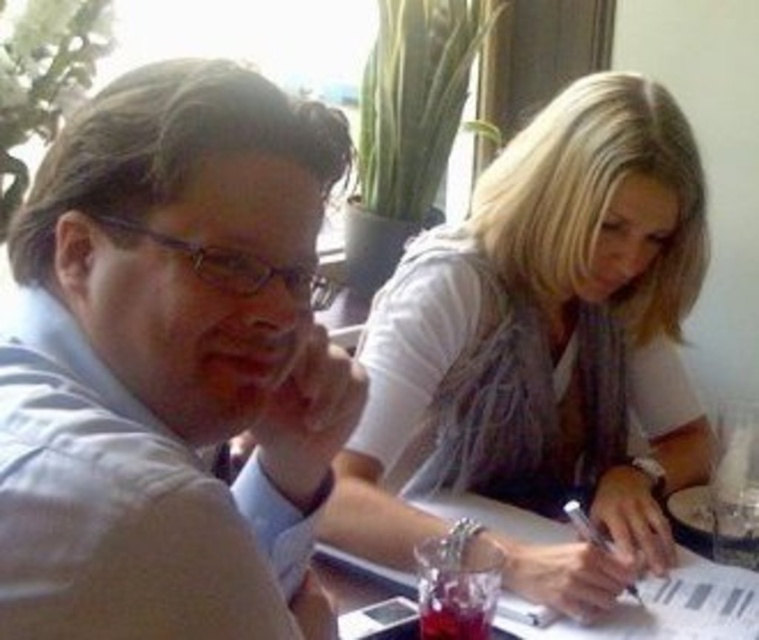
Question: Does white fabric shirt at upper right have a larger size compared to clear plastic table at center?

Choices:
 (A) yes
 (B) no

Answer: (A)

Question: Which object is the farthest from the white fabric shirt at upper right?

Choices:
 (A) light blue shirt at center
 (B) clear plastic table at center

Answer: (A)

Question: From the image, what is the correct spatial relationship of white fabric shirt at upper right in relation to clear plastic table at center?

Choices:
 (A) left
 (B) right

Answer: (B)

Question: Which of these objects is positioned closest to the light blue shirt at center?

Choices:
 (A) white fabric shirt at upper right
 (B) clear plastic table at center

Answer: (A)

Question: Based on their relative distances, which object is farther from the light blue shirt at center?

Choices:
 (A) clear plastic table at center
 (B) white fabric shirt at upper right

Answer: (A)

Question: Is light blue shirt at center further to camera compared to white fabric shirt at upper right?

Choices:
 (A) no
 (B) yes

Answer: (A)